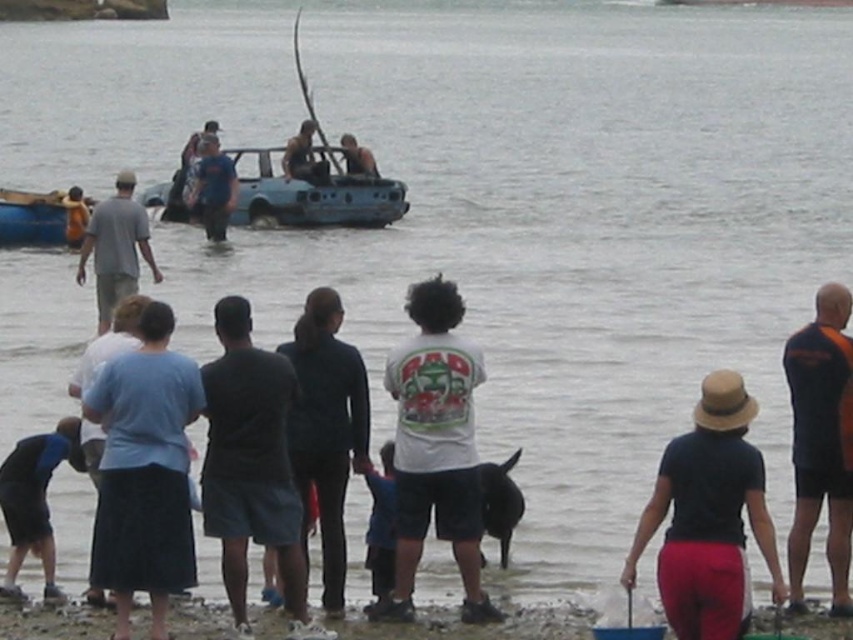
Based on the photo, you are a photographer taking a picture of the scene. You want to ensure both the dark gray shorts at center and the blue fabric shirt at center are clearly visible. Which one should you focus on first to ensure it appears sharp in the photo?

You should focus on the dark gray shorts at center first because it is closer to the viewer than the blue fabric shirt at center, so focusing on it will ensure both objects are in focus through the depth of field.

You are a photographer standing at the shoreline and want to capture a photo of the light blue fabric shirt at lower left and orange mesh shirt at right. Which shirt should you focus on first if you want to ensure both are in the frame without moving the camera?

The light blue fabric shirt at lower left is below orange mesh shirt at right, so you should focus on the orange mesh shirt at right first to ensure both are in the frame without moving the camera.